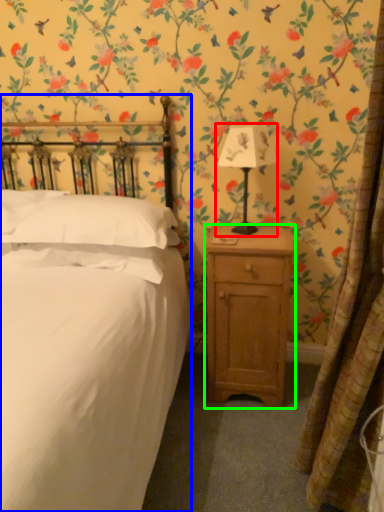
Question: Estimate the real-world distances between objects in this image. Which object is closer to bedside lamp (highlighted by a red box), bed (highlighted by a blue box) or nightstand (highlighted by a green box)?

Choices:
 (A) bed
 (B) nightstand

Answer: (B)